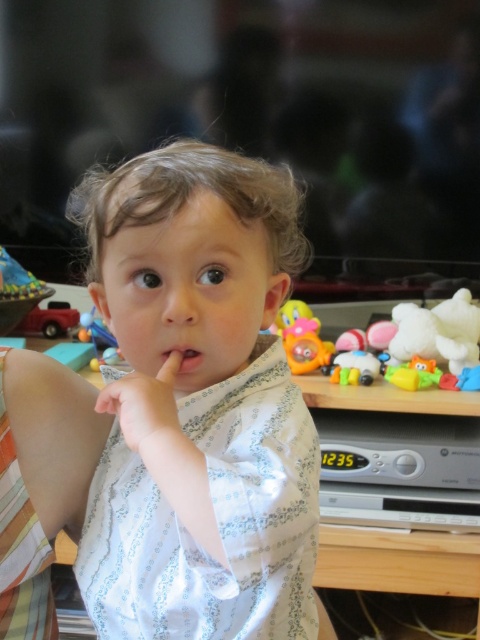
The child is trying to hold the plastic yellow duckling at right with their smooth skin hand at center. Based on their sizes, will the child be able to fully grasp the duckling?

The plastic yellow duckling at right is wider than the smooth skin hand at center, so the child won

You are a photographer setting up a shoot in the living room. You notice the smooth skin hand at center and the pink matte flesh at center. Which object is located below the other?

The smooth skin hand at center is positioned under the pink matte flesh at center.